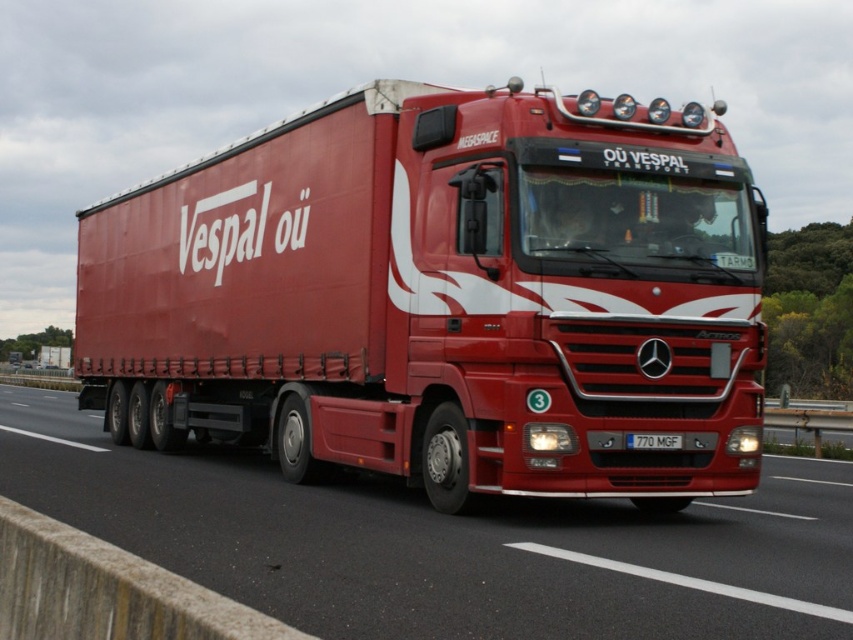
Question: Does glossy asphalt road at center have a smaller size compared to white plastic license plate at center?

Choices:
 (A) no
 (B) yes

Answer: (A)

Question: Which of the following is the closest to the observer?

Choices:
 (A) white plastic license plate at center
 (B) matte red trailer truck at center

Answer: (B)

Question: Is matte red trailer truck at center positioned behind white plastic license plate at center?

Choices:
 (A) yes
 (B) no

Answer: (B)

Question: Based on their relative distances, which object is nearer to the matte red trailer truck at center?

Choices:
 (A) glossy asphalt road at center
 (B) white plastic license plate at center

Answer: (A)

Question: Considering the real-world distances, which object is closest to the glossy asphalt road at center?

Choices:
 (A) white plastic license plate at center
 (B) matte red trailer truck at center

Answer: (B)

Question: Is matte red trailer truck at center bigger than glossy asphalt road at center?

Choices:
 (A) no
 (B) yes

Answer: (B)